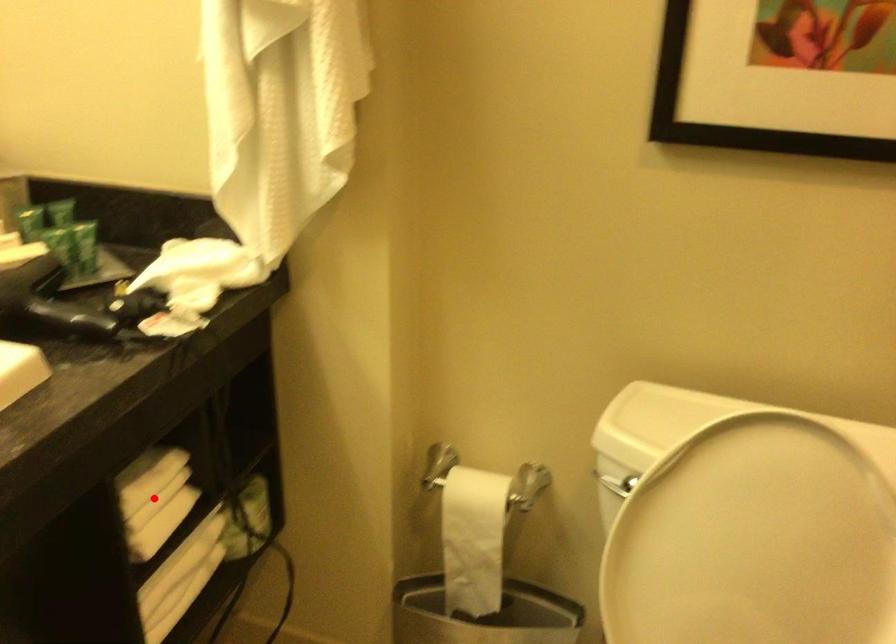
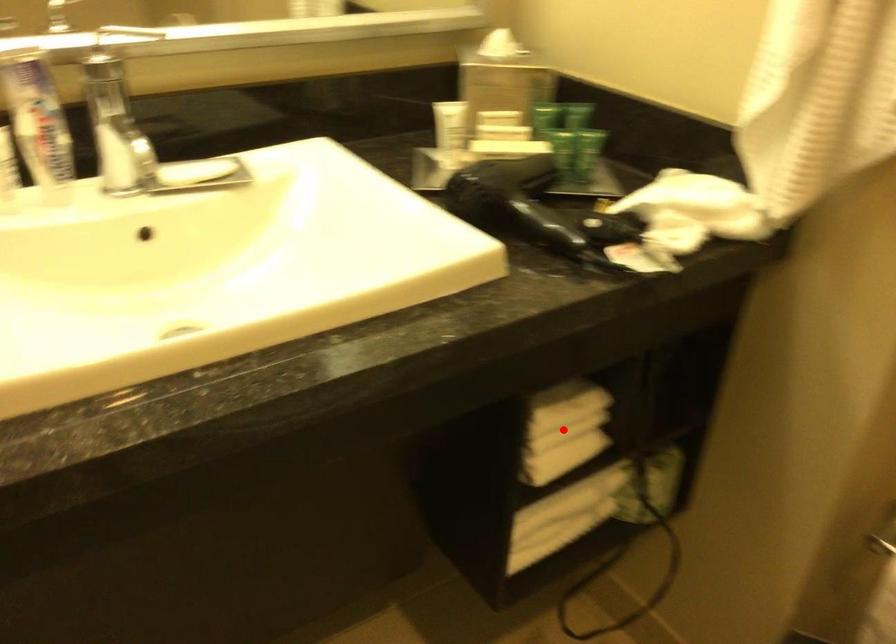
I am providing you with two images of the same scene from different viewpoints. A red point is marked on the first image and another point is marked on the second image. Do the highlighted points in image1 and image2 indicate the same real-world spot?

Yes